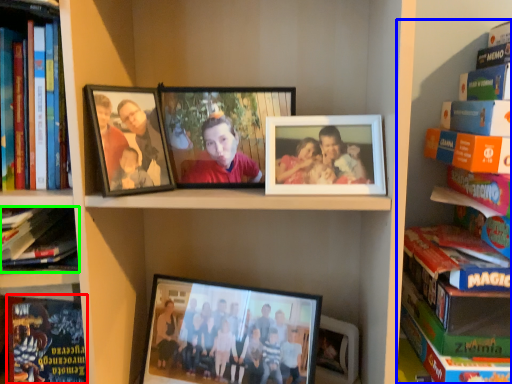
Question: Estimate the real-world distances between objects in this image. Which object is closer to paperback book (highlighted by a red box), book (highlighted by a blue box) or book (highlighted by a green box)?

Choices:
 (A) book
 (B) book

Answer: (B)